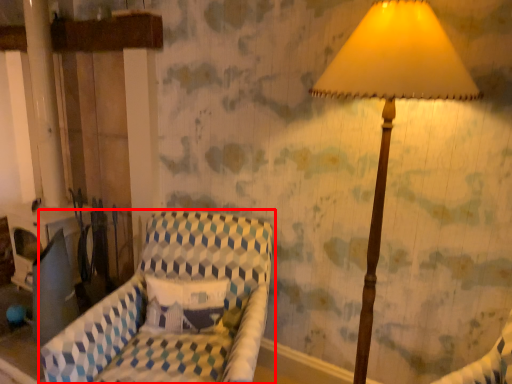
Question: From the image's perspective, where is furniture (annotated by the red box) located relative to lamp?

Choices:
 (A) below
 (B) above

Answer: (A)